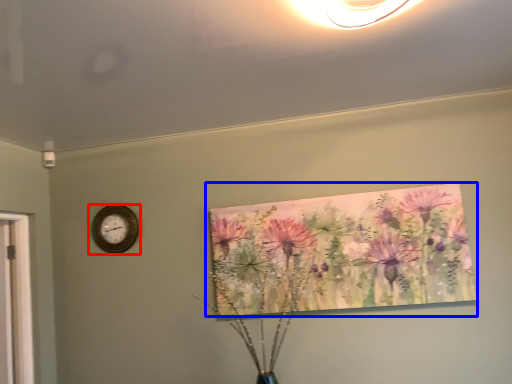
Question: Which object is closer to the camera taking this photo, wall clock (highlighted by a red box) or floral arrangement (highlighted by a blue box)?

Choices:
 (A) wall clock
 (B) floral arrangement

Answer: (B)